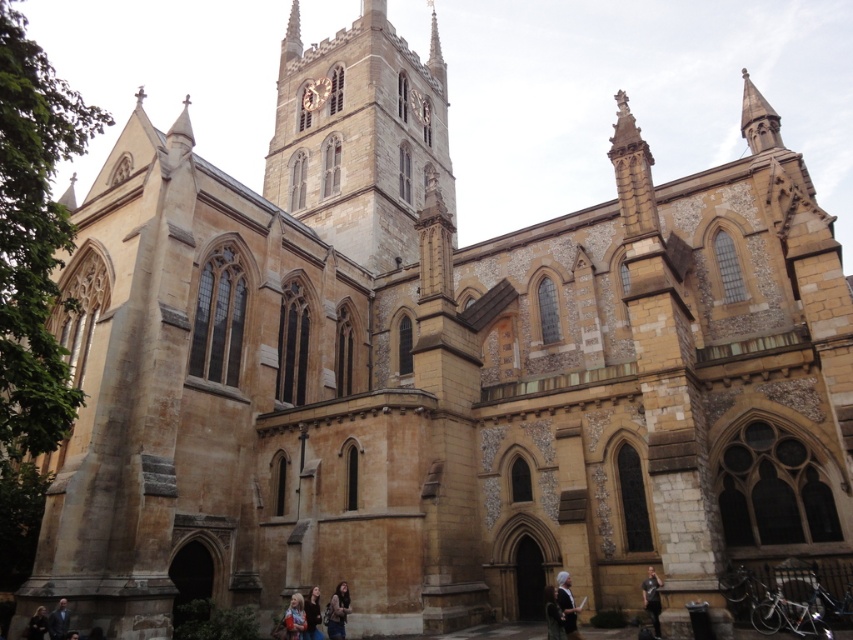
You are a GUI agent. You are given a task and a screenshot of the screen. Output one action in this format:
    pyautogui.click(x=<x>, y=<y>)
    Task: Click on the dark brown leather jacket at lower right
    This screenshot has width=853, height=640.
    Given the screenshot: What is the action you would take?
    pyautogui.click(x=553, y=614)

Which is below, dark brown leather jacket at lower right or light brown leather jacket at lower center?

dark brown leather jacket at lower right is lower down.

The width and height of the screenshot is (853, 640). Describe the element at coordinates (553, 614) in the screenshot. I see `dark brown leather jacket at lower right` at that location.

In order to click on dark brown leather jacket at lower right in this screenshot , I will do `click(553, 614)`.

Which is behind, point (654, 634) or point (289, 621)?

The point (289, 621) is more distant.

Does dark blue shirt at lower center appear over matte brown hair at lower center?

Yes, dark blue shirt at lower center is above matte brown hair at lower center.

Is point (651, 600) positioned in front of point (294, 621)?

Yes, it is.

Find the location of a particular element. dark blue shirt at lower center is located at coordinates (653, 598).

Is golden stone tower at center in front of dark brown leather jacket at lower right?

That is False.

Can you confirm if golden stone tower at center is positioned below dark brown leather jacket at lower right?

No.

Find the location of a particular element. golden stone tower at center is located at coordinates (360, 138).